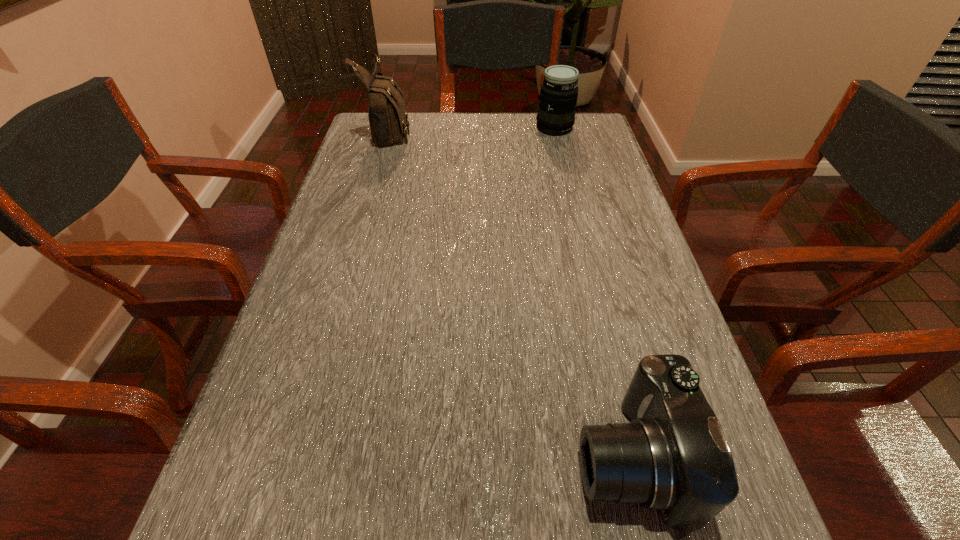
Locate an element on the screen. shoulder bag is located at coordinates (388, 118).

Where is `the leftmost object`? the leftmost object is located at coordinates (388, 118).

Locate an element on the screen. This screenshot has width=960, height=540. the second shortest object is located at coordinates (558, 96).

Find the location of `the nearest object`. the nearest object is located at coordinates (673, 457).

Where is `the shortest object`? the shortest object is located at coordinates (673, 457).

At what (x,y) coordinates should I click in order to perform the action: click on free spot located 0.120m on the front-facing side of the tallest object. Please return your answer as a coordinate pair (x, y). The width and height of the screenshot is (960, 540). Looking at the image, I should click on (450, 132).

You are a GUI agent. You are given a task and a screenshot of the screen. Output one action in this format:
    pyautogui.click(x=<x>, y=<y>)
    Task: Click on the vacant area situated 0.370m on the left of the telephoto lens
    This screenshot has width=960, height=540.
    Given the screenshot: What is the action you would take?
    pyautogui.click(x=418, y=128)

Identify the location of vacant area situated 0.280m on the lens of the shortest object. The image size is (960, 540). (393, 457).

Locate an element on the screen. vacant space located 0.180m on the lens of the shortest object is located at coordinates (459, 457).

Find the location of a particular element. This screenshot has height=540, width=960. vacant space located on the lens of the shortest object is located at coordinates (412, 457).